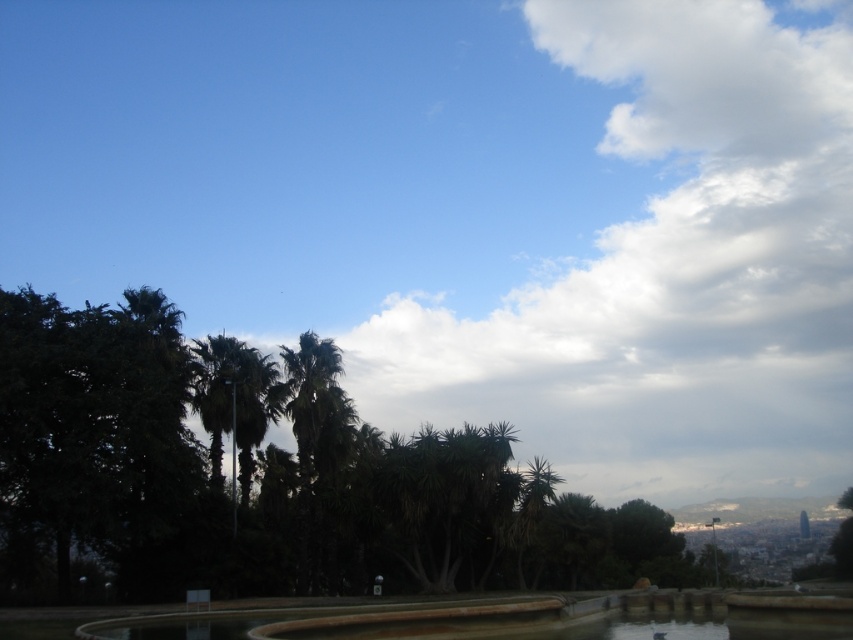
Question: Estimate the real-world distances between objects in this image. Which object is closer to the green leafy tree at center?

Choices:
 (A) green leafy palm tree at left
 (B) brown stone fountain at lower center

Answer: (A)

Question: Which point is closer to the camera?

Choices:
 (A) brown stone fountain at lower center
 (B) green leafy tree at center

Answer: (A)

Question: Can you confirm if green leafy tree at center is positioned below green leafy palm tree at left?

Choices:
 (A) yes
 (B) no

Answer: (A)

Question: In this image, where is green leafy tree at center located relative to brown stone fountain at lower center?

Choices:
 (A) left
 (B) right

Answer: (B)

Question: Estimate the real-world distances between objects in this image. Which object is farther from the brown stone fountain at lower center?

Choices:
 (A) green leafy tree at center
 (B) green leafy palm tree at left

Answer: (B)

Question: Observing the image, what is the correct spatial positioning of brown stone fountain at lower center in reference to green leafy palm tree at left?

Choices:
 (A) above
 (B) below

Answer: (B)